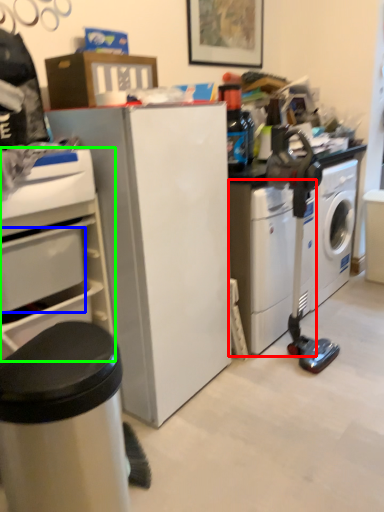
Question: Which is farther away from washing machine (highlighted by a red box)? drawer (highlighted by a blue box) or home appliance (highlighted by a green box)?

Choices:
 (A) drawer
 (B) home appliance

Answer: (A)